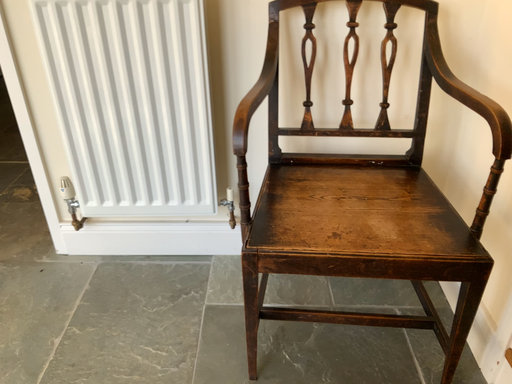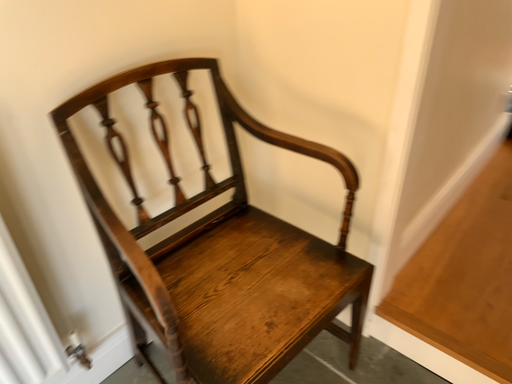
Question: Which way did the camera rotate in the video?

Choices:
 (A) rotated upward
 (B) rotated downward

Answer: (A)